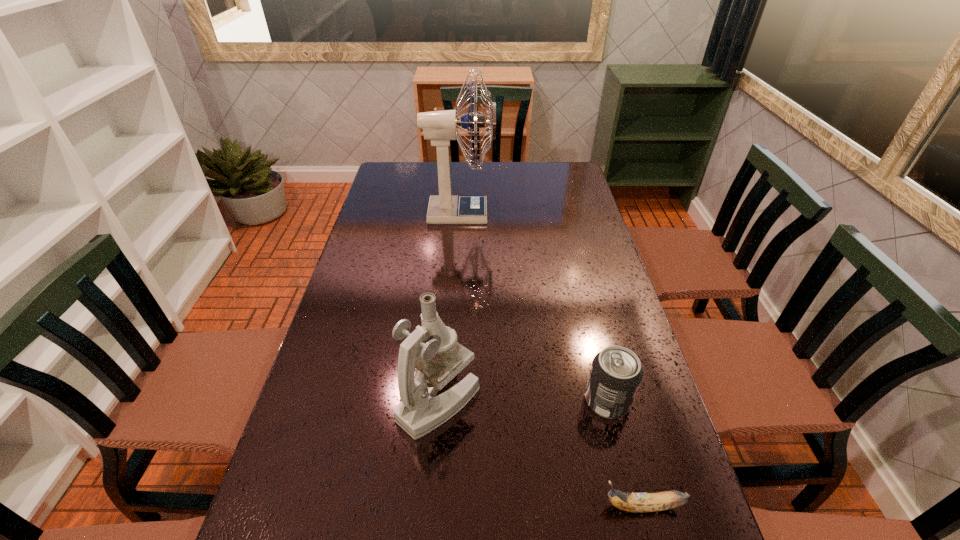
Locate an element on the screen. The image size is (960, 540). blank region between the second shortest object and the fan is located at coordinates (534, 307).

Find the location of a particular element. free space between the microscope and the fan is located at coordinates (449, 307).

In order to click on empty space between the tallest object and the second tallest object in this screenshot , I will do `click(449, 307)`.

Locate an element on the screen. free space between the tallest object and the third shortest object is located at coordinates (449, 307).

At what (x,y) coordinates should I click in order to perform the action: click on vacant area that lies between the shortest object and the microscope. Please return your answer as a coordinate pair (x, y). The image size is (960, 540). Looking at the image, I should click on (540, 453).

Image resolution: width=960 pixels, height=540 pixels. I want to click on empty space that is in between the third shortest object and the fan, so click(x=449, y=307).

Identify the location of vacant space that's between the tallest object and the microscope. (449, 307).

Locate an element on the screen. The width and height of the screenshot is (960, 540). vacant area that lies between the fan and the third shortest object is located at coordinates tap(449, 307).

Find the location of `free space that is in between the nearest object and the fan`. free space that is in between the nearest object and the fan is located at coordinates (551, 360).

This screenshot has height=540, width=960. I want to click on vacant region between the nearest object and the soda can, so click(x=625, y=454).